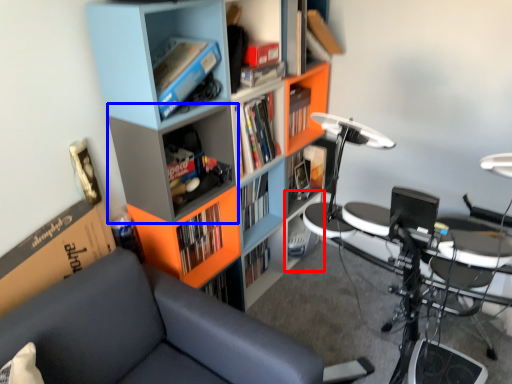
Question: Which object appears farthest to the camera in this image, cabinet (highlighted by a red box) or shelf (highlighted by a blue box)?

Choices:
 (A) cabinet
 (B) shelf

Answer: (A)